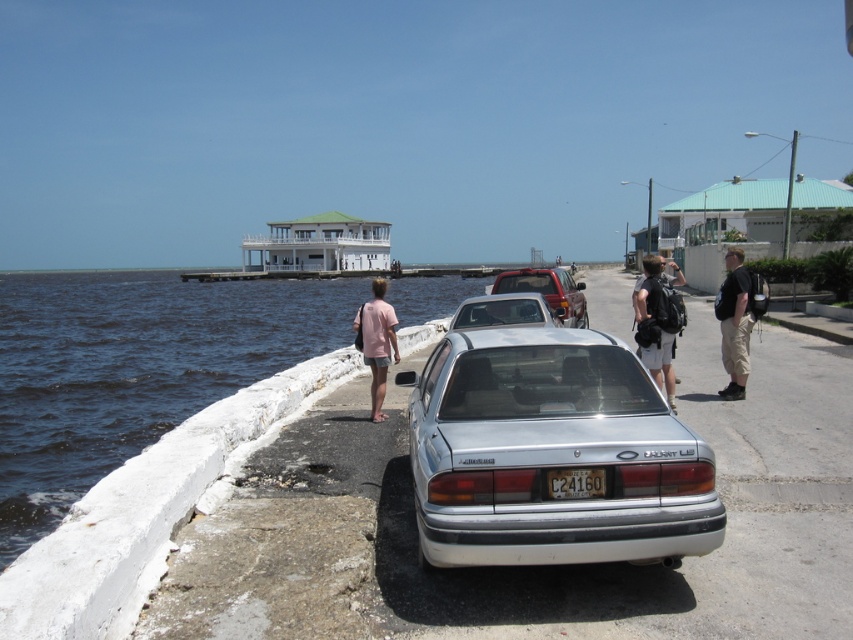
You are a hiker who needs to carry your matte black backpack at center through a narrow path between the metallic silver pickup truck at center and a tree. The path is only 1.2 meters wide. Can your backpack fit through without touching the truck or the tree?

The matte black backpack at center is much taller than the metallic silver pickup truck at center, so it might not fit through the 1.2 meter wide path without touching the truck or the tree. Check the backpack dimensions before proceeding.

You are driving a car that is 4 meters long. You want to park your car in the parking spot where the silver metallic sedan at center is currently parked. Is your car too long to fit in that spot?

The silver metallic sedan at center is 4.09 meters from camera. Since your car is 4 meters long, it should fit in the parking spot as it is slightly shorter than the existing car.

You are a delivery robot with a width of 1 meter. You need to move from the silver metallic sedan at center to the matte black backpack at center. Can you fit through the space between them without touching either?

The distance between the silver metallic sedan at center and the matte black backpack at center is 1.46 meters. Since the robot is 1 meter wide, there is enough space to move through without touching either object.